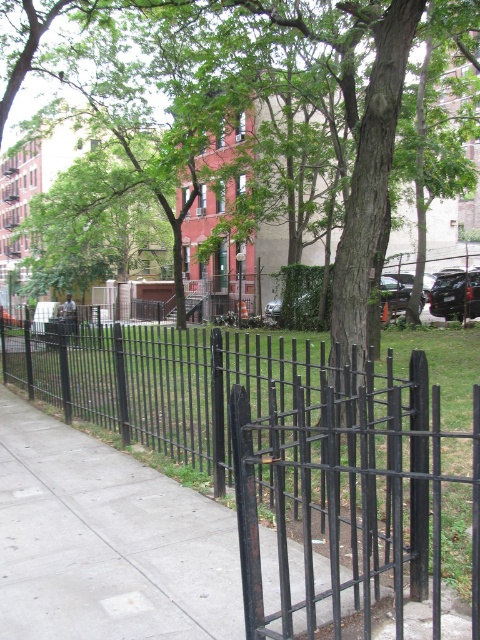
You are a maintenance worker needing to trim the green leafy tree at center. The black metal fence at center is in the way. Can you safely trim the tree without damaging the fence?

The black metal fence at center is located below the green leafy tree at center, so you can safely trim the tree without damaging the fence since the fence is positioned lower than the tree.

You are a delivery person trying to navigate through the park area. You need to deliver a package to the address located behind the green leafy tree at center. The sidewalk is on your left. To reach the destination, should you walk to the left or right of the black metal fence at center?

You should walk to the right of the black metal fence at center because the black metal fence at center is to the left of green leafy tree at center, so moving right will lead you towards the tree.

You are a city planner assessing the park layout. You need to install a new bench that requires a 15 feet clearance between the black metal fence at center and the green leafy tree at center. Based on the scene, will the existing spacing between them allow for this bench installation?

The black metal fence at center is 14.92 feet from the green leafy tree at center, which is slightly less than the required 15 feet clearance. Therefore, the existing spacing does not allow for the bench installation as it falls short by 0.08 feet.